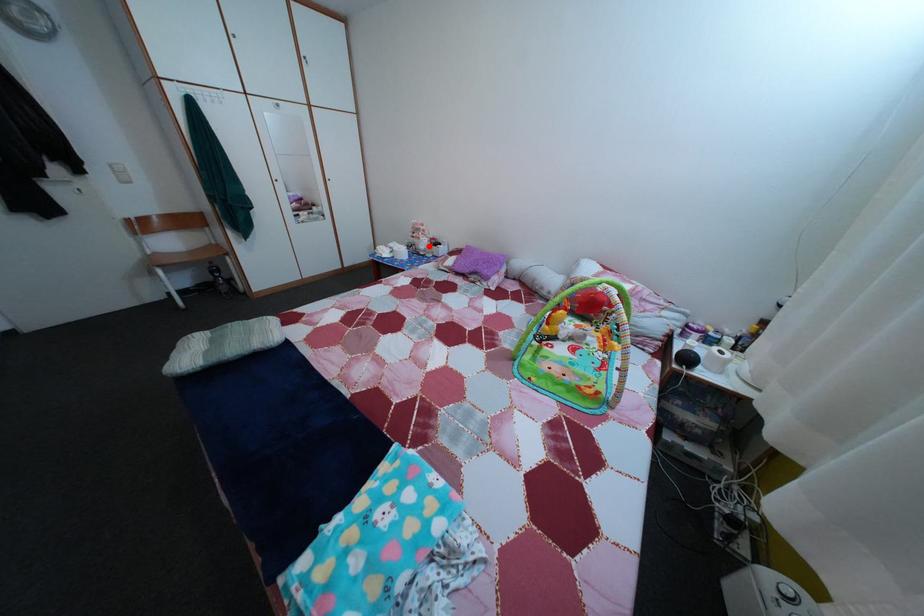
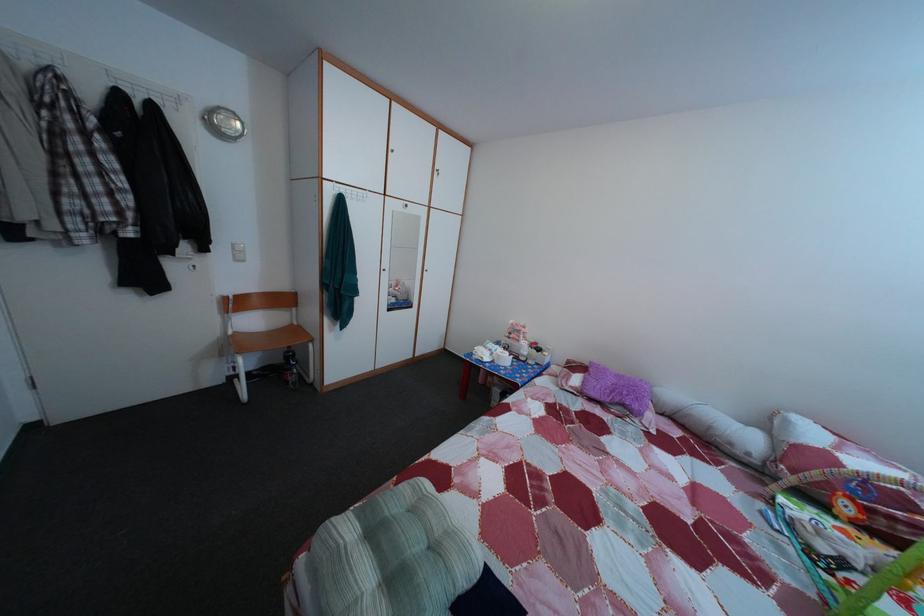
Question: A red point is marked in image1. In image2, is the corresponding 3D point closer to the camera or farther? Reply with the corresponding letter.

Choices:
 (A) The corresponding 3D point is closer.
 (B) The corresponding 3D point is farther.

Answer: (B)